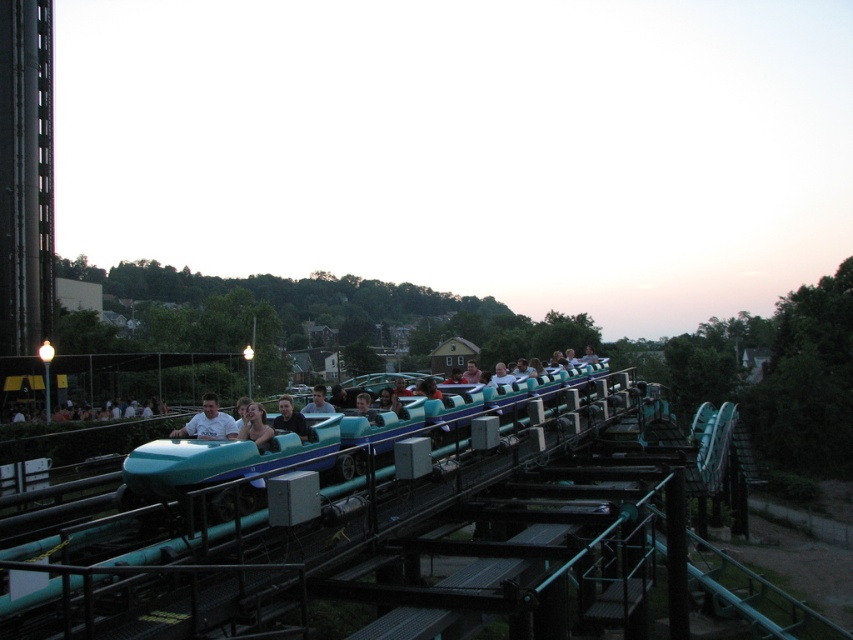
You are a safety inspector checking the amusement park. You notice the teal glossy roller coaster rail at center and the matte blue helmet at center. According to safety regulations, the roller coaster rail must be at least 2 meters taller than any nearby helmet to prevent collisions. Is the current height difference compliant with the regulation?

The teal glossy roller coaster rail at center is much taller than the matte blue helmet at center, so it likely meets the requirement of being at least 2 meters taller, ensuring compliance with safety regulations.

You are a safety inspector checking the amusement park. You see a point at coordinates (207, 422). What object does this point correspond to?

The point at coordinates (207, 422) corresponds to the light blue plastic helmet at center.